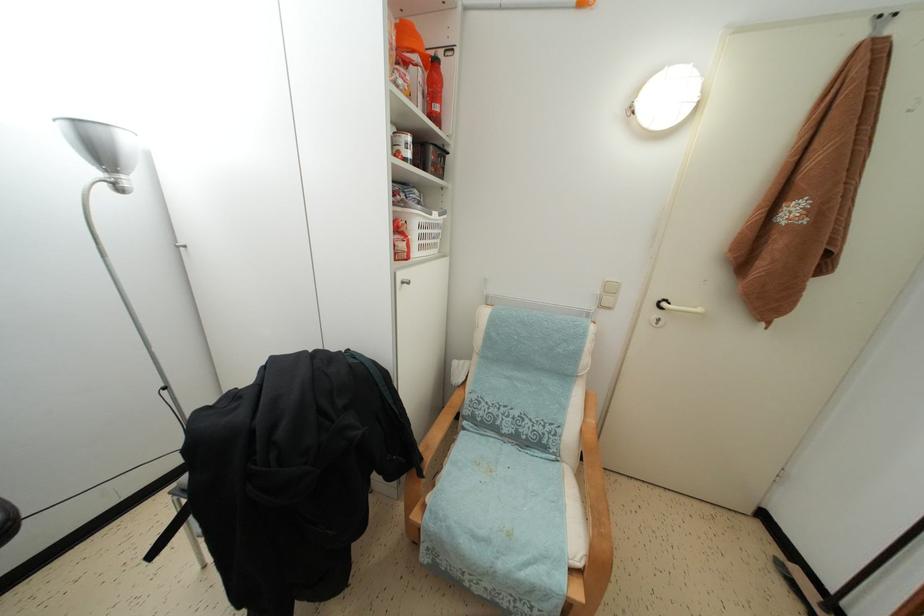
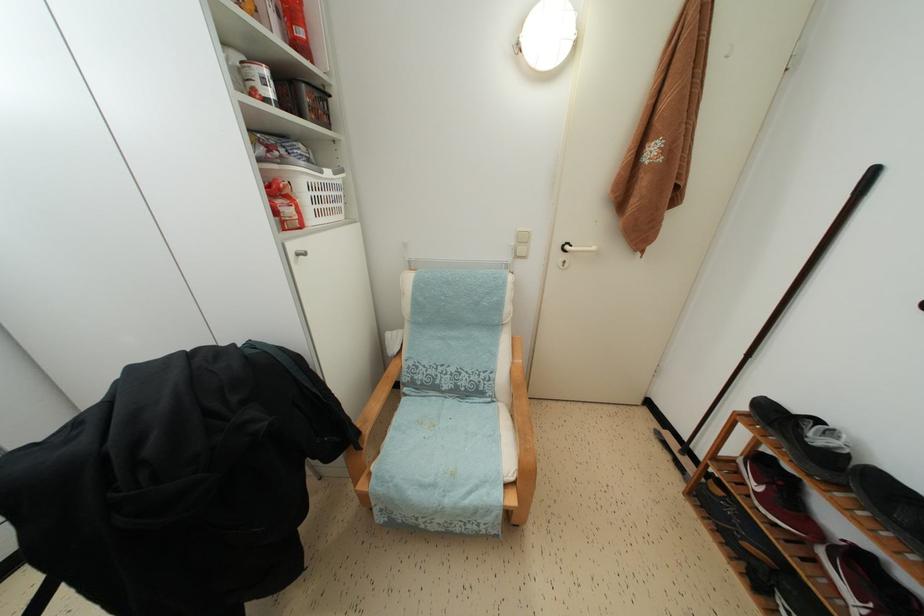
The point at (426, 241) is marked in the first image. Where is the corresponding point in the second image?

(319, 206)